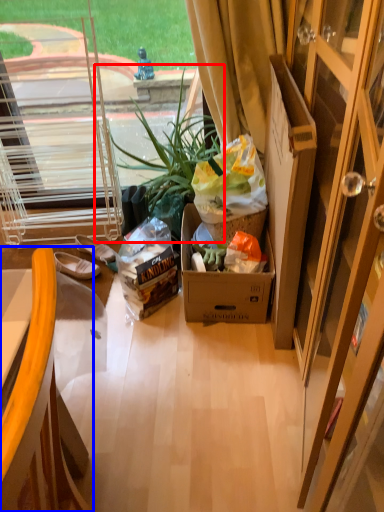
Question: Which object is closer to the camera taking this photo, houseplant (highlighted by a red box) or chair (highlighted by a blue box)?

Choices:
 (A) houseplant
 (B) chair

Answer: (B)